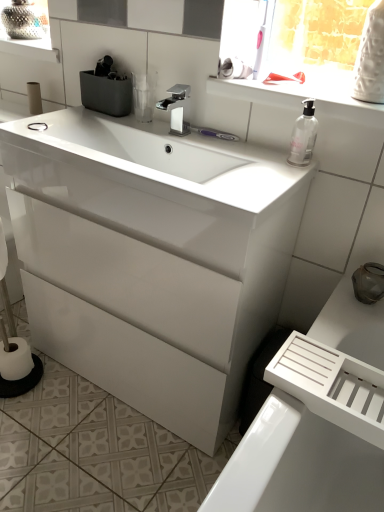
Question: Considering the positions of polished chrome faucet at center and white matte toilet paper at left, the 3th toilet paper when ordered from front to back, in the image, is polished chrome faucet at center bigger or smaller than white matte toilet paper at left, the 3th toilet paper when ordered from front to back,?

Choices:
 (A) small
 (B) big

Answer: (B)

Question: From a real-world perspective, relative to white matte toilet paper at left, which is counted as the 3th toilet paper, starting from the bottom, is polished chrome faucet at center vertically above or below?

Choices:
 (A) below
 (B) above

Answer: (B)

Question: Which object is the closest to the polished chrome faucet at center?

Choices:
 (A) white glossy sink at center
 (B) white glossy cabinet at center
 (C) white matte toilet paper at lower left, the 1th toilet paper in the left-to-right sequence
 (D) white matte toilet paper at upper center, which is the 3th toilet paper in left-to-right order
 (E) clear glass soap dispenser at upper right

Answer: (D)

Question: Which object is the farthest from the white matte toilet paper at lower left, the 2th toilet paper positioned from the front?

Choices:
 (A) white glossy sink at center
 (B) polished chrome faucet at center
 (C) white matte toilet paper at upper center, marked as the second toilet paper in a top-to-bottom arrangement
 (D) clear glass soap dispenser at upper right
 (E) white matte toilet paper at left, positioned as the first toilet paper in back-to-front order

Answer: (C)